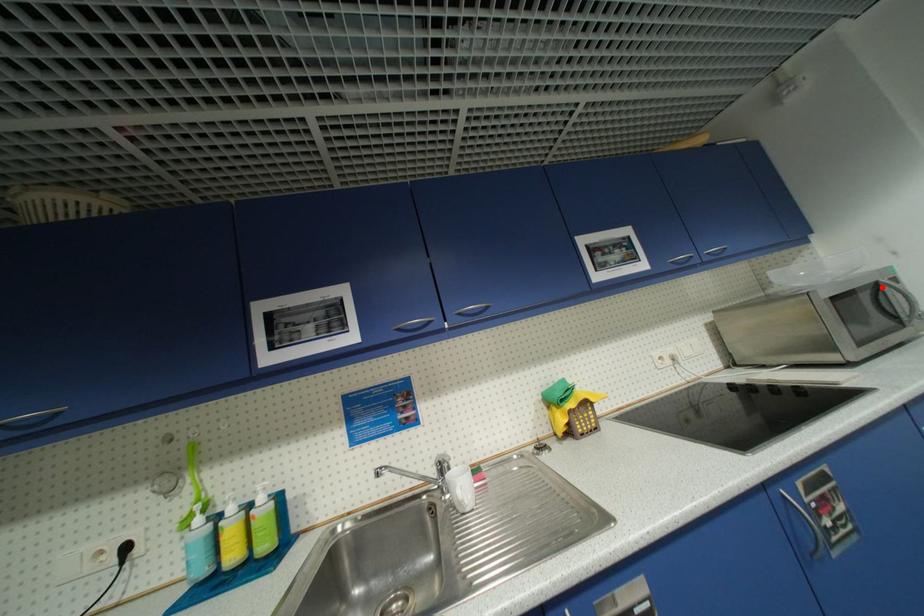
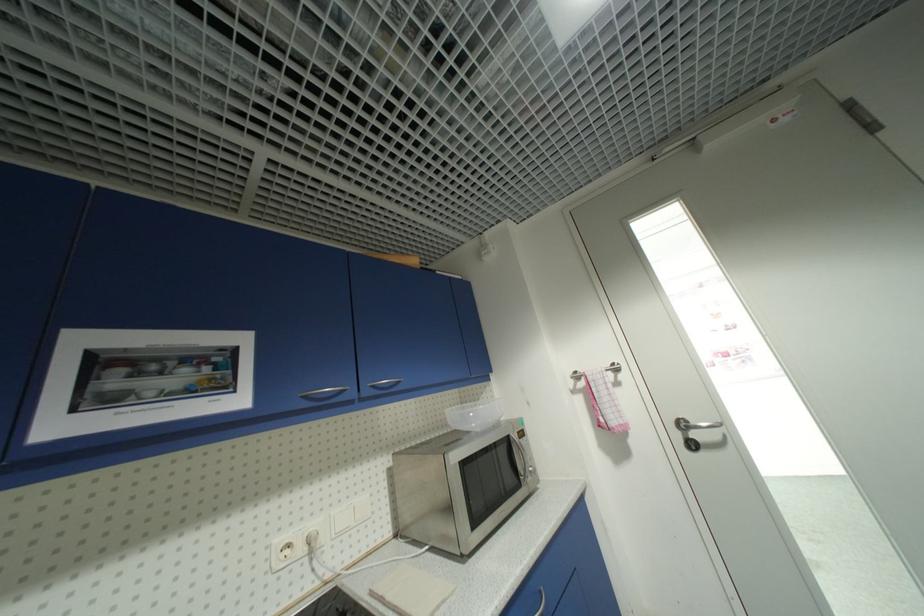
The point at the highlighted location is marked in the first image. Where is the corresponding point in the second image?

(514, 440)